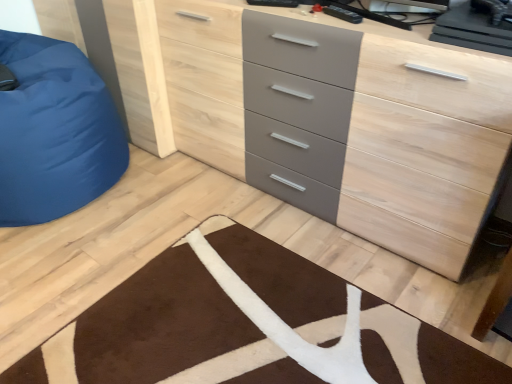
What do you see at coordinates (342, 123) in the screenshot? I see `matte gray chest of drawers at center` at bounding box center [342, 123].

You are a GUI agent. You are given a task and a screenshot of the screen. Output one action in this format:
    pyautogui.click(x=<x>, y=<y>)
    Task: Click on the blue fabric bean bag at left
    The height and width of the screenshot is (384, 512).
    Given the screenshot: What is the action you would take?
    pyautogui.click(x=54, y=132)

Locate an element on the screen. The width and height of the screenshot is (512, 384). matte gray chest of drawers at center is located at coordinates (342, 123).

Does point (275, 381) come behind point (366, 117)?

No, (275, 381) is closer to viewer.

Which object is thinner, brown plush rug at lower center or matte gray chest of drawers at center?

Thinner between the two is matte gray chest of drawers at center.

Can you confirm if brown plush rug at lower center is shorter than matte gray chest of drawers at center?

Yes, brown plush rug at lower center is shorter than matte gray chest of drawers at center.

How many degrees apart are the facing directions of brown plush rug at lower center and matte gray chest of drawers at center?

The angle between the facing direction of brown plush rug at lower center and the facing direction of matte gray chest of drawers at center is 0.0108 degrees.

This screenshot has width=512, height=384. There is a blue fabric bean bag at left. Identify the location of the chest of drawers above it (from a real-world perspective). (342, 123).

From the image's perspective, is matte gray chest of drawers at center on top of blue fabric bean bag at left?

No, from the image's perspective, matte gray chest of drawers at center is not above blue fabric bean bag at left.

Is matte gray chest of drawers at center aimed at blue fabric bean bag at left?

No, matte gray chest of drawers at center is not oriented towards blue fabric bean bag at left.

Can you confirm if matte gray chest of drawers at center is taller than blue fabric bean bag at left?

Indeed, matte gray chest of drawers at center has a greater height compared to blue fabric bean bag at left.

Based on the photo, can you tell me how much blue fabric bean bag at left and matte gray chest of drawers at center differ in facing direction?

They differ by 0.344 degrees in their facing directions.

From a real-world perspective, is blue fabric bean bag at left physically located above or below matte gray chest of drawers at center?

Clearly, from a real-world perspective, blue fabric bean bag at left is below matte gray chest of drawers at center.

In terms of height, does blue fabric bean bag at left look taller or shorter compared to matte gray chest of drawers at center?

Clearly, blue fabric bean bag at left is shorter compared to matte gray chest of drawers at center.

Is brown plush rug at lower center positioned far away from blue fabric bean bag at left?

Actually, brown plush rug at lower center and blue fabric bean bag at left are a little close together.

Would you say brown plush rug at lower center is to the left or to the right of blue fabric bean bag at left in the picture?

Clearly, brown plush rug at lower center is on the right of blue fabric bean bag at left in the image.

From the image's perspective, is brown plush rug at lower center under blue fabric bean bag at left?

Yes, from the image's perspective, brown plush rug at lower center is below blue fabric bean bag at left.

Could blue fabric bean bag at left be considered to be inside brown plush rug at lower center?

No, blue fabric bean bag at left is not surrounded by brown plush rug at lower center.

Looking at this image, between blue fabric bean bag at left and brown plush rug at lower center, which one has less height?

brown plush rug at lower center.

From a real-world perspective, who is located higher, blue fabric bean bag at left or brown plush rug at lower center?

blue fabric bean bag at left is physically above.

Which object is thinner, blue fabric bean bag at left or brown plush rug at lower center?

blue fabric bean bag at left.

Does blue fabric bean bag at left come in front of brown plush rug at lower center?

No, it is behind brown plush rug at lower center.

From the image's perspective, which is above, matte gray chest of drawers at center or brown plush rug at lower center?

matte gray chest of drawers at center appears higher in the image.

Would you say matte gray chest of drawers at center is a long distance from brown plush rug at lower center?

No, there isn't a large distance between matte gray chest of drawers at center and brown plush rug at lower center.

Considering the positions of objects matte gray chest of drawers at center and brown plush rug at lower center in the image provided, who is in front, matte gray chest of drawers at center or brown plush rug at lower center?

brown plush rug at lower center is more forward.

Considering the sizes of objects matte gray chest of drawers at center and brown plush rug at lower center in the image provided, who is shorter, matte gray chest of drawers at center or brown plush rug at lower center?

Standing shorter between the two is brown plush rug at lower center.

Image resolution: width=512 pixels, height=384 pixels. Find the location of `doormat below the matte gray chest of drawers at center (from a real-world perspective)`. doormat below the matte gray chest of drawers at center (from a real-world perspective) is located at coordinates [198, 319].

Identify the location of chest of drawers above the blue fabric bean bag at left (from a real-world perspective). This screenshot has width=512, height=384. (342, 123).

Looking at the image, which one is located further to brown plush rug at lower center, blue fabric bean bag at left or matte gray chest of drawers at center?

Based on the image, blue fabric bean bag at left appears to be further to brown plush rug at lower center.

When comparing their distances from blue fabric bean bag at left, does brown plush rug at lower center or matte gray chest of drawers at center seem further?

brown plush rug at lower center lies further to blue fabric bean bag at left than the other object.

Based on their spatial positions, is brown plush rug at lower center or blue fabric bean bag at left closer to matte gray chest of drawers at center?

Based on the image, brown plush rug at lower center appears to be nearer to matte gray chest of drawers at center.

Based on their spatial positions, is matte gray chest of drawers at center or brown plush rug at lower center further from blue fabric bean bag at left?

brown plush rug at lower center.

Estimate the real-world distances between objects in this image. Which object is further from matte gray chest of drawers at center, blue fabric bean bag at left or brown plush rug at lower center?

Among the two, blue fabric bean bag at left is located further to matte gray chest of drawers at center.

Estimate the real-world distances between objects in this image. Which object is closer to brown plush rug at lower center, matte gray chest of drawers at center or blue fabric bean bag at left?

matte gray chest of drawers at center lies closer to brown plush rug at lower center than the other object.

The image size is (512, 384). I want to click on doormat between blue fabric bean bag at left and matte gray chest of drawers at center in the horizontal direction, so click(198, 319).